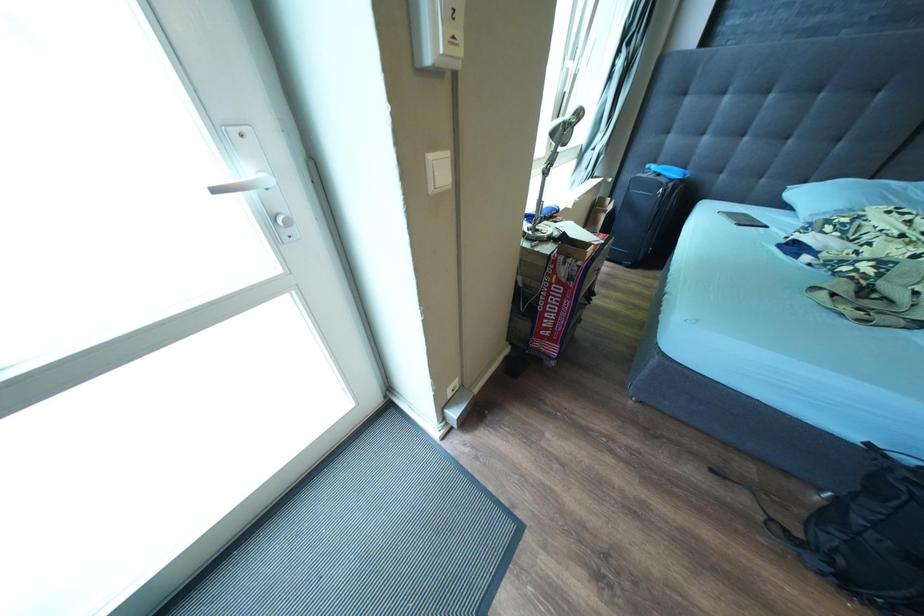
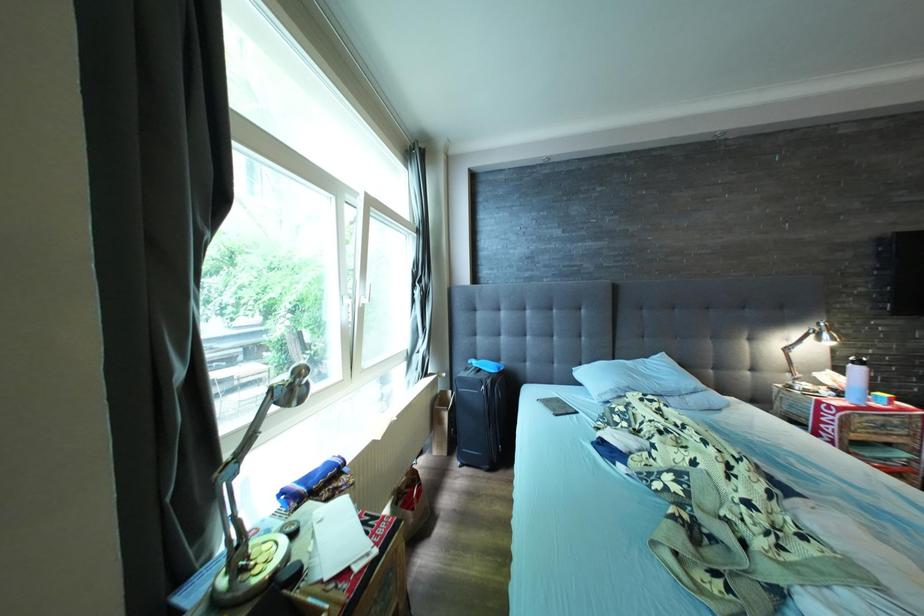
Looking at this image, how did the camera likely rotate?

The camera rotated toward right-up.